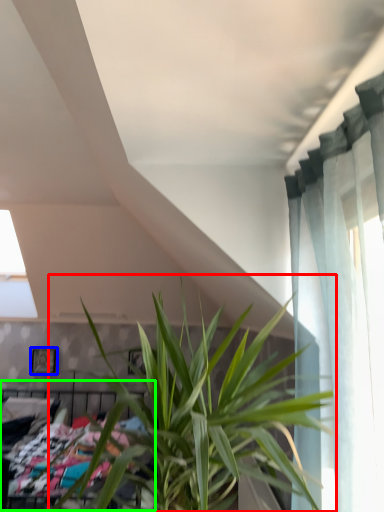
Question: Which object is positioned farthest from houseplant (highlighted by a red box)? Select from picture frame (highlighted by a blue box) and bed (highlighted by a green box).

Choices:
 (A) picture frame
 (B) bed

Answer: (A)